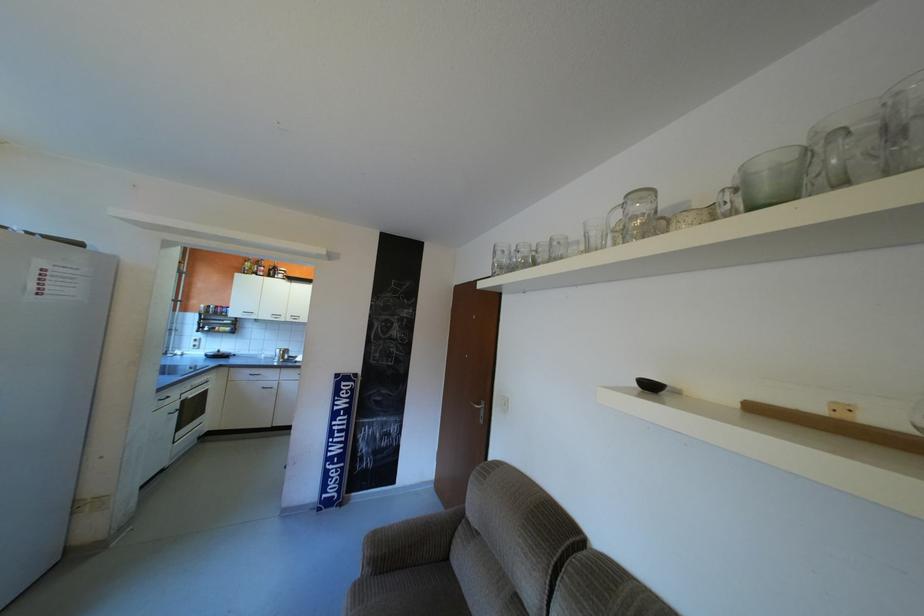
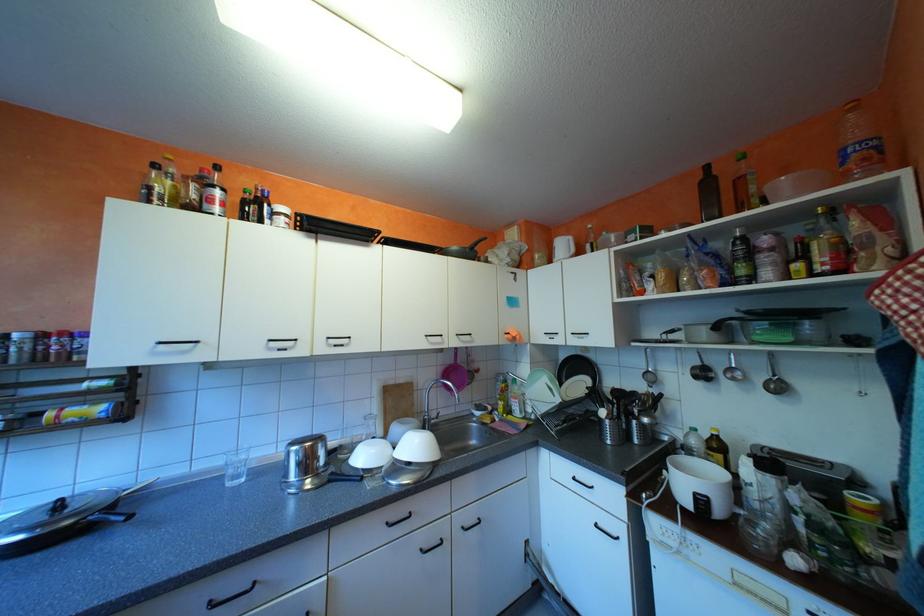
Locate, in the second image, the point that corresponds to (284,272) in the first image.

(263, 208)